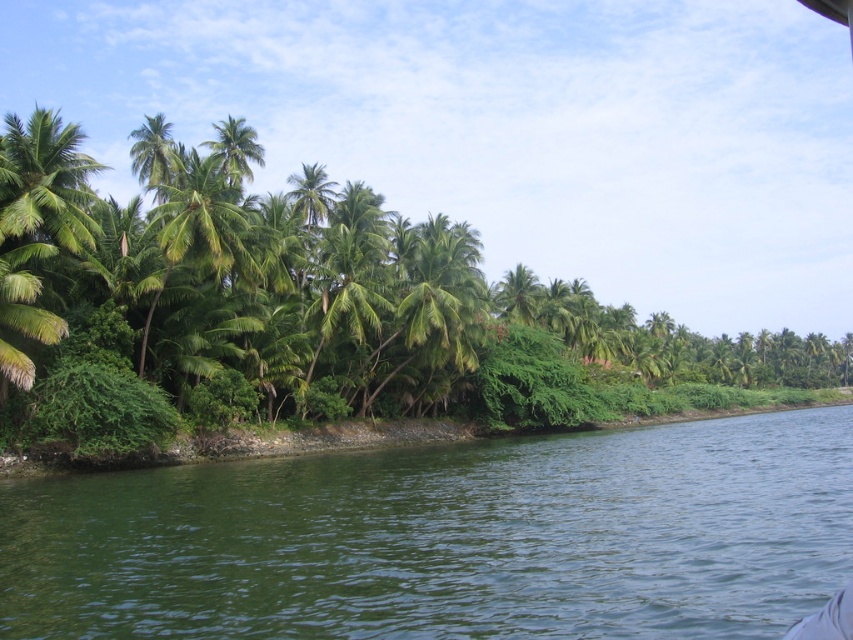
At what (x,y) coordinates should I click in order to perform the action: click on green water at lower center. Please return your answer as a coordinate pair (x, y). This screenshot has height=640, width=853. Looking at the image, I should click on (448, 538).

Between green water at lower center and green leafy palm tree at upper center, which one is positioned lower?

green water at lower center

I want to click on green water at lower center, so click(x=448, y=538).